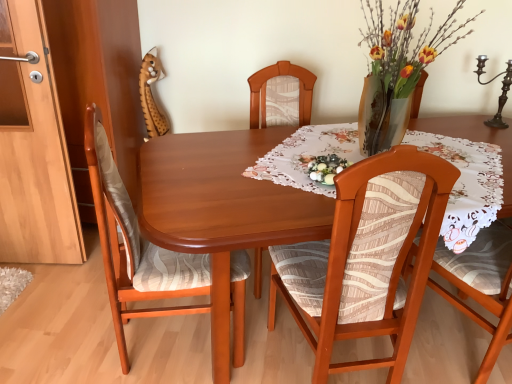
This screenshot has height=384, width=512. Identify the location of vacant space underneath wooden chair with patterned fabric at center, which is counted as the second chair, starting from the left (from a real-world perspective). (312, 354).